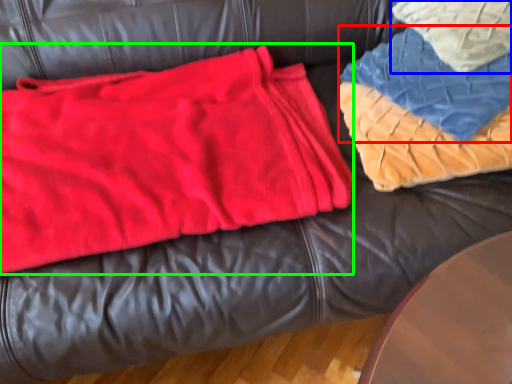
Question: Estimate the real-world distances between objects in this image. Which object is farther from blanket (highlighted by a red box), throw pillow (highlighted by a blue box) or bean bag chair (highlighted by a green box)?

Choices:
 (A) throw pillow
 (B) bean bag chair

Answer: (B)